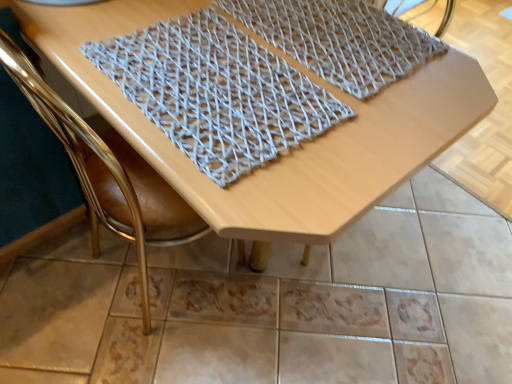
Question: Is wooden table at center taller than gold leather chair at upper left?

Choices:
 (A) no
 (B) yes

Answer: (A)

Question: From the image's perspective, is wooden table at center over gold leather chair at upper left?

Choices:
 (A) no
 (B) yes

Answer: (B)

Question: Can you confirm if wooden table at center is bigger than gold leather chair at upper left?

Choices:
 (A) yes
 (B) no

Answer: (A)

Question: Is wooden table at center not inside gold leather chair at upper left?

Choices:
 (A) no
 (B) yes

Answer: (B)

Question: Is wooden table at center closer to camera compared to gold leather chair at upper left?

Choices:
 (A) no
 (B) yes

Answer: (B)

Question: From the image's perspective, is gray woven mat at upper center, which is counted as the second blanket, starting from the left, above or below wooden table at center?

Choices:
 (A) below
 (B) above

Answer: (B)

Question: Is gray woven mat at upper center, acting as the 1th blanket starting from the right, wider or thinner than wooden table at center?

Choices:
 (A) thin
 (B) wide

Answer: (A)

Question: Which is correct: gray woven mat at upper center, acting as the 1th blanket starting from the right, is inside wooden table at center, or outside of it?

Choices:
 (A) inside
 (B) outside

Answer: (A)

Question: Is gray woven mat at upper center, which is counted as the second blanket, starting from the left, to the left or to the right of wooden table at center in the image?

Choices:
 (A) left
 (B) right

Answer: (B)

Question: In the image, is gold leather chair at upper left positioned in front of or behind gray woven mat at upper center, acting as the 1th blanket starting from the right?

Choices:
 (A) front
 (B) behind

Answer: (A)

Question: Considering the relative positions of gold leather chair at upper left and gray woven mat at upper center, acting as the 1th blanket starting from the right, in the image provided, is gold leather chair at upper left to the left or to the right of gray woven mat at upper center, acting as the 1th blanket starting from the right,?

Choices:
 (A) left
 (B) right

Answer: (A)

Question: Would you say gold leather chair at upper left is inside or outside gray woven mat at upper center, which is counted as the second blanket, starting from the left?

Choices:
 (A) outside
 (B) inside

Answer: (A)

Question: Does point (130, 233) appear closer or farther from the camera than point (377, 26)?

Choices:
 (A) farther
 (B) closer

Answer: (A)

Question: From the image's perspective, is knitted fabric at center, which ranks as the 2th blanket in right-to-left order, above or below wooden table at center?

Choices:
 (A) above
 (B) below

Answer: (A)

Question: Is point (184, 150) closer or farther from the camera than point (314, 180)?

Choices:
 (A) farther
 (B) closer

Answer: (A)